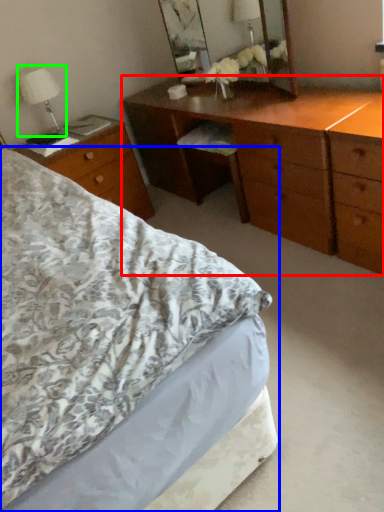
Question: Which object is the closest to the chest of drawers (highlighted by a red box)? Choose among these: bed (highlighted by a blue box) or bedside lamp (highlighted by a green box).

Choices:
 (A) bed
 (B) bedside lamp

Answer: (A)